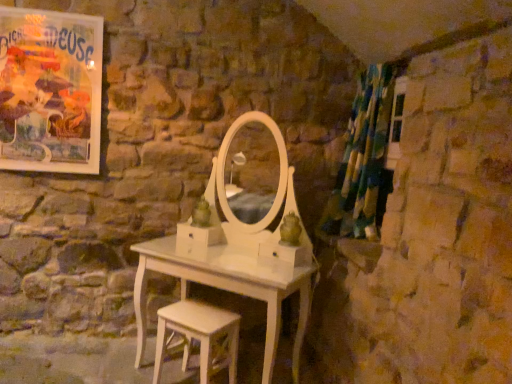
The height and width of the screenshot is (384, 512). Identify the location of white wood stool at lower center. (198, 335).

Describe the element at coordinates (50, 91) in the screenshot. I see `matte paper poster at upper left` at that location.

You are a GUI agent. You are given a task and a screenshot of the screen. Output one action in this format:
    pyautogui.click(x=<x>, y=<y>)
    Task: Click on the white wood stool at lower center
    
    Given the screenshot: What is the action you would take?
    pyautogui.click(x=198, y=335)

From a real-world perspective, is white wood stool at lower center above or below matte paper poster at upper left?

white wood stool at lower center is below matte paper poster at upper left.

Does white wood stool at lower center contain matte paper poster at upper left?

Actually, matte paper poster at upper left is outside white wood stool at lower center.

Does point (206, 305) come behind point (96, 163)?

Yes, it is behind point (96, 163).

Where is `stool on the left of green and blue fabric shower curtain at right`? This screenshot has height=384, width=512. stool on the left of green and blue fabric shower curtain at right is located at coordinates pyautogui.click(x=198, y=335).

Is white wood stool at lower center taller or shorter than green and blue fabric shower curtain at right?

In the image, white wood stool at lower center appears to be shorter than green and blue fabric shower curtain at right.

What's the angular difference between white wood stool at lower center and green and blue fabric shower curtain at right's facing directions?

There is a 48.5-degree angle between the facing directions of white wood stool at lower center and green and blue fabric shower curtain at right.

Is white wood stool at lower center next to green and blue fabric shower curtain at right?

No, white wood stool at lower center is not with green and blue fabric shower curtain at right.

From a real-world perspective, which object stands above the other?

matte paper poster at upper left is physically above.

Are green and blue fabric shower curtain at right and matte paper poster at upper left located far from each other?

green and blue fabric shower curtain at right is far away from matte paper poster at upper left.

From the image's perspective, which one is positioned higher, green and blue fabric shower curtain at right or matte paper poster at upper left?

matte paper poster at upper left is shown above in the image.

Between point (348, 171) and point (6, 93), which one is positioned in front?

The point (6, 93) is closer to the camera.

Image resolution: width=512 pixels, height=384 pixels. Find the location of `stool beneath the matte paper poster at upper left (from a real-world perspective)`. stool beneath the matte paper poster at upper left (from a real-world perspective) is located at coordinates (198, 335).

Is matte paper poster at upper left facing towards white wood stool at lower center?

No.

Do you think matte paper poster at upper left is within white wood stool at lower center, or outside of it?

matte paper poster at upper left is not enclosed by white wood stool at lower center.

Would you consider matte paper poster at upper left to be distant from white wood stool at lower center?

Absolutely, matte paper poster at upper left is distant from white wood stool at lower center.

How much distance is there between matte paper poster at upper left and green and blue fabric shower curtain at right?

matte paper poster at upper left and green and blue fabric shower curtain at right are 1.81 meters apart.

Can you confirm if matte paper poster at upper left is taller than green and blue fabric shower curtain at right?

Incorrect, the height of matte paper poster at upper left is not larger of that of green and blue fabric shower curtain at right.

Is matte paper poster at upper left wider than green and blue fabric shower curtain at right?

Incorrect, the width of matte paper poster at upper left does not surpass that of green and blue fabric shower curtain at right.

Which point is more forward, (379, 71) or (167, 329)?

The point (167, 329) is closer.

Is green and blue fabric shower curtain at right at the right side of white wood stool at lower center?

Correct, you'll find green and blue fabric shower curtain at right to the right of white wood stool at lower center.

From the image's perspective, would you say green and blue fabric shower curtain at right is positioned over white wood stool at lower center?

Indeed, from the image's perspective, green and blue fabric shower curtain at right is shown above white wood stool at lower center.

From a real-world perspective, who is located higher, green and blue fabric shower curtain at right or white wood stool at lower center?

In real-world perspective, green and blue fabric shower curtain at right is above.

Where is `stool in front of the matte paper poster at upper left`? stool in front of the matte paper poster at upper left is located at coordinates (198, 335).

The height and width of the screenshot is (384, 512). I want to click on stool below the green and blue fabric shower curtain at right (from the image's perspective), so click(x=198, y=335).

Which object lies nearer to the anchor point white wood stool at lower center, matte paper poster at upper left or green and blue fabric shower curtain at right?

green and blue fabric shower curtain at right.

Estimate the real-world distances between objects in this image. Which object is closer to white wood stool at lower center, green and blue fabric shower curtain at right or matte paper poster at upper left?

green and blue fabric shower curtain at right lies closer to white wood stool at lower center than the other object.

When comparing their distances from green and blue fabric shower curtain at right, does matte paper poster at upper left or white wood stool at lower center seem closer?

Based on the image, white wood stool at lower center appears to be nearer to green and blue fabric shower curtain at right.

Estimate the real-world distances between objects in this image. Which object is further from matte paper poster at upper left, white wood stool at lower center or green and blue fabric shower curtain at right?

green and blue fabric shower curtain at right is further to matte paper poster at upper left.

Considering their positions, is white wood stool at lower center positioned further to green and blue fabric shower curtain at right than matte paper poster at upper left?

The object further to green and blue fabric shower curtain at right is matte paper poster at upper left.

Consider the image. Considering their positions, is green and blue fabric shower curtain at right positioned further to matte paper poster at upper left than white wood stool at lower center?

green and blue fabric shower curtain at right is further to matte paper poster at upper left.

Find the location of a particular element. stool located between matte paper poster at upper left and green and blue fabric shower curtain at right in the left-right direction is located at coordinates (198, 335).